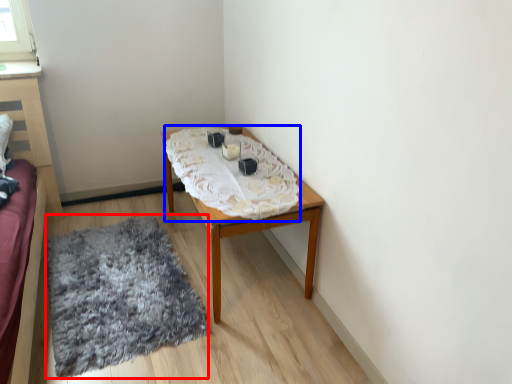
Question: Among these objects, which one is farthest to the camera, mat (highlighted by a red box) or blanket (highlighted by a blue box)?

Choices:
 (A) mat
 (B) blanket

Answer: (B)